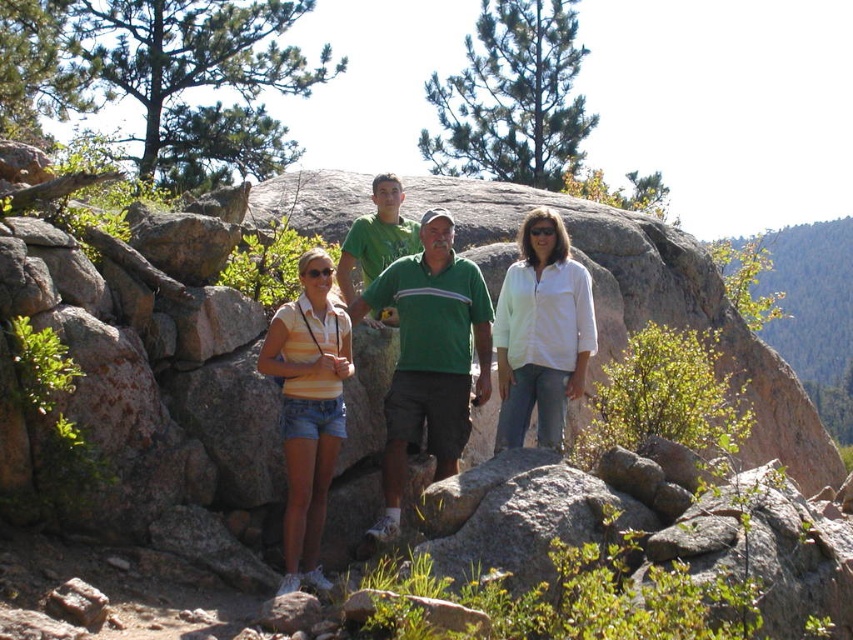
Question: In this image, where is white cotton shirt at center located relative to green cotton shirt at center?

Choices:
 (A) above
 (B) below

Answer: (B)

Question: Does green cotton polo shirt at center appear on the left side of yellow striped shirt at center?

Choices:
 (A) yes
 (B) no

Answer: (B)

Question: Which object appears closest to the camera in this image?

Choices:
 (A) yellow striped shirt at center
 (B) green cotton shirt at center

Answer: (A)

Question: Which point is closer to the camera taking this photo?

Choices:
 (A) (573, 269)
 (B) (381, 202)

Answer: (A)

Question: Is striped cotton shirt at center above white cotton shirt at center?

Choices:
 (A) no
 (B) yes

Answer: (A)

Question: Considering the real-world distances, which object is farthest from the green cotton shirt at center?

Choices:
 (A) green cotton polo shirt at center
 (B) white cotton shirt at center
 (C) yellow striped shirt at center
 (D) striped cotton shirt at center

Answer: (C)